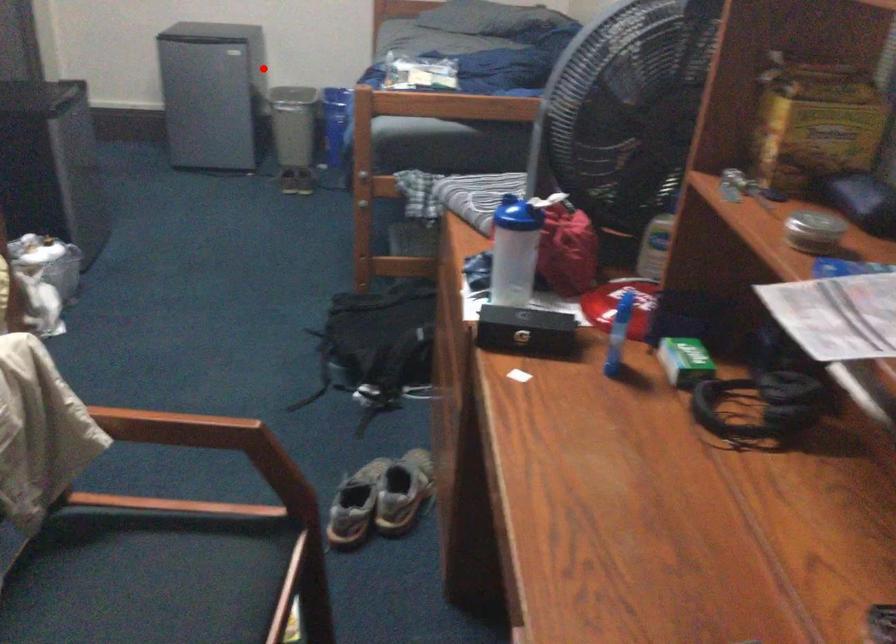
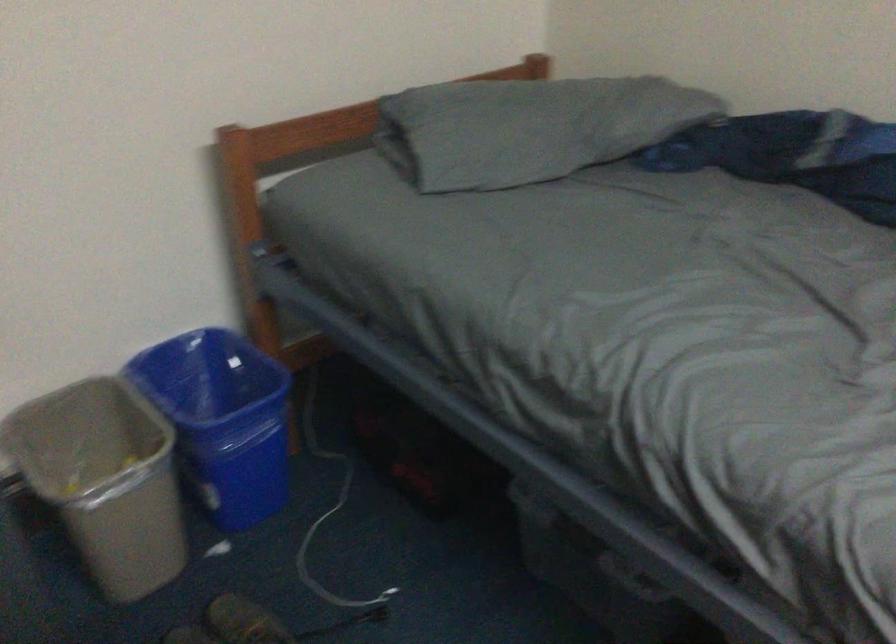
Question: I am providing you with two images of the same scene from different viewpoints. A red point is shown in image1. For the corresponding object point in image2, is it positioned nearer or farther from the camera?

Choices:
 (A) Nearer
 (B) Farther

Answer: (A)